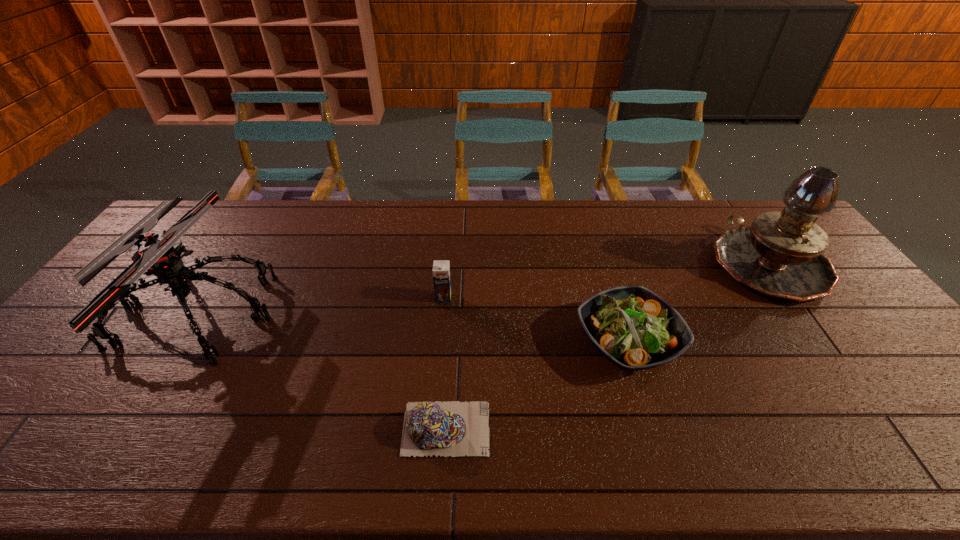
Locate an element on the screen. The width and height of the screenshot is (960, 540). free space at the right edge of the desktop is located at coordinates (842, 288).

At what (x,y) coordinates should I click in order to perform the action: click on free space between the third shortest object and the salad plate. Please return your answer as a coordinate pair (x, y). Image resolution: width=960 pixels, height=540 pixels. Looking at the image, I should click on (536, 320).

Where is `free space between the shortest object and the fourth shortest object`? This screenshot has width=960, height=540. free space between the shortest object and the fourth shortest object is located at coordinates (321, 370).

Locate an element on the screen. The image size is (960, 540). free space between the tallest object and the fourth object from left to right is located at coordinates (697, 303).

Image resolution: width=960 pixels, height=540 pixels. In order to click on free space between the third tallest object and the oil lamp in this screenshot , I will do `click(606, 281)`.

This screenshot has height=540, width=960. What are the coordinates of `empty space between the second shortest object and the chocolate milk` in the screenshot? It's located at (536, 320).

Locate an element on the screen. The image size is (960, 540). vacant space that's between the third tallest object and the tallest object is located at coordinates (606, 281).

This screenshot has width=960, height=540. Identify the location of free space between the drone and the tallest object. (481, 288).

You are a GUI agent. You are given a task and a screenshot of the screen. Output one action in this format:
    pyautogui.click(x=<x>, y=<y>)
    Task: Click on the free spot between the third tallest object and the leftmost object
    
    Given the screenshot: What is the action you would take?
    pyautogui.click(x=320, y=305)

Locate an element on the screen. This screenshot has width=960, height=540. object that is the third closest to the tallest object is located at coordinates (441, 268).